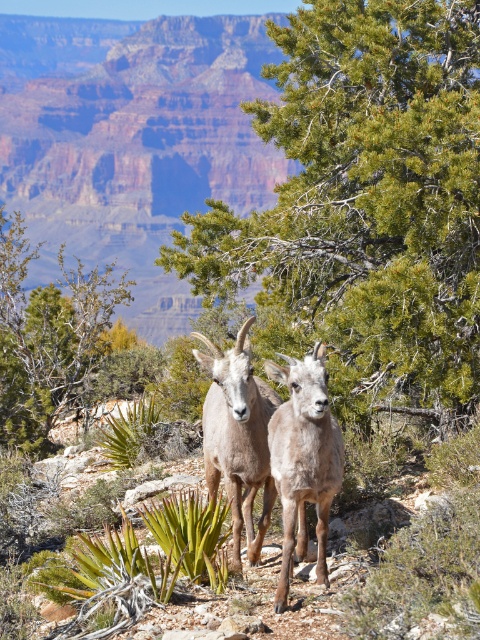
Measure the distance between point (2, 248) and camera.

Point (2, 248) is 19.56 meters away from camera.

Does point (2, 268) come behind point (235, 481)?

Yes, it is behind point (235, 481).

Between point (98, 326) and point (235, 564), which one is positioned in front?

Positioned in front is point (235, 564).

The image size is (480, 640). What are the coordinates of `green leafy tree at center` in the screenshot? It's located at (48, 337).

Image resolution: width=480 pixels, height=640 pixels. What do you see at coordinates (365, 202) in the screenshot? I see `green needle-like tree at center` at bounding box center [365, 202].

Does green needle-like tree at center lie behind fuzzy brown goat at center?

Yes, green needle-like tree at center is further from the viewer.

The image size is (480, 640). What do you see at coordinates (365, 202) in the screenshot?
I see `green needle-like tree at center` at bounding box center [365, 202].

Locate an element on the screen. green needle-like tree at center is located at coordinates (365, 202).

Between point (48, 285) and point (299, 426), which one is positioned behind?

The point (48, 285) is more distant.

At what (x,y) coordinates should I click in order to perform the action: click on green leafy tree at center. Please return your answer as a coordinate pair (x, y). Looking at the image, I should click on (48, 337).

Who is more forward, (3, 435) or (268, 372)?

Point (268, 372)

Image resolution: width=480 pixels, height=640 pixels. Identify the location of green leafy tree at center. (48, 337).